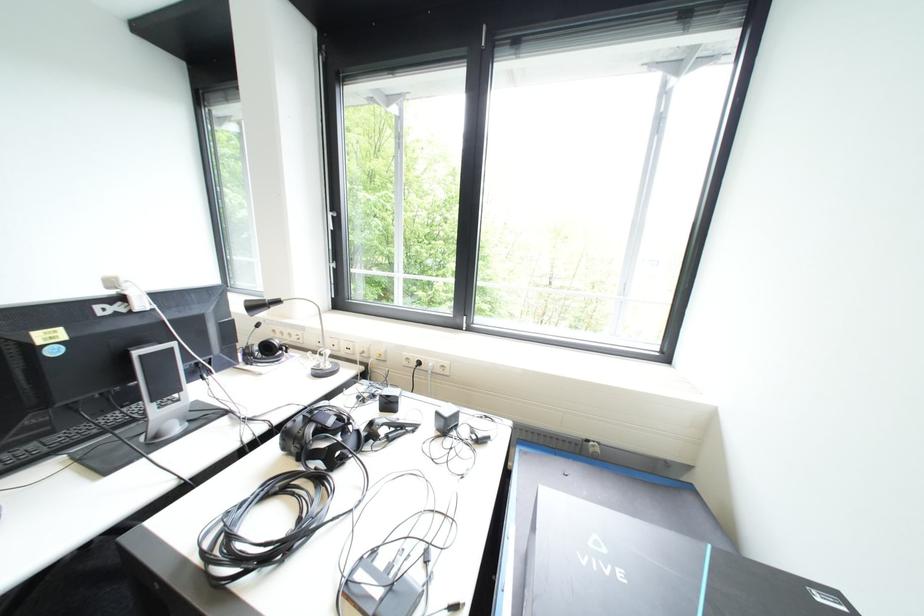
Find where to pull the white window handle. Please return your answer as a coordinate pair (x, y).

(332, 217)